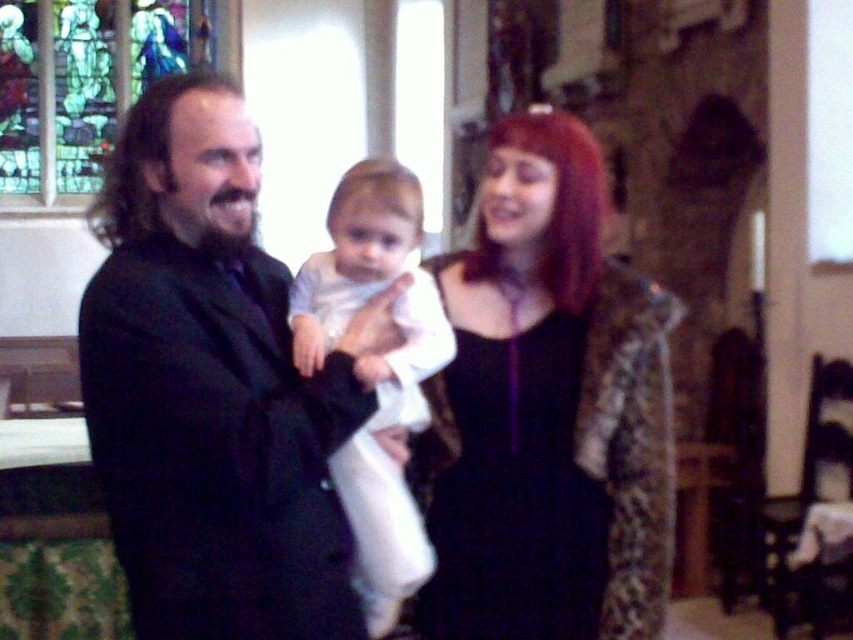
You are standing in the church and want to take a photo of the black matte suit at center and the stained glass window at upper left. Which object is positioned lower in the image?

The black matte suit at center is positioned lower than the stained glass window at upper left.

You are a photographer setting up for a family portrait in a church. You need to ensure that the shiny black dress at center and the white clothed baby at center are both visible in the frame. Given their sizes, which object should you focus on first to ensure proper exposure?

The shiny black dress at center is taller than the white clothed baby at center, so you should focus on the shiny black dress at center first to ensure proper exposure for the larger subject.

You are standing in the church and want to take a photo of the black matte suit at center. Where should you position yourself to capture it in the frame?

The black matte suit at center is located at point (209, 388), so you should position yourself directly in front of that coordinate to capture it in the frame.